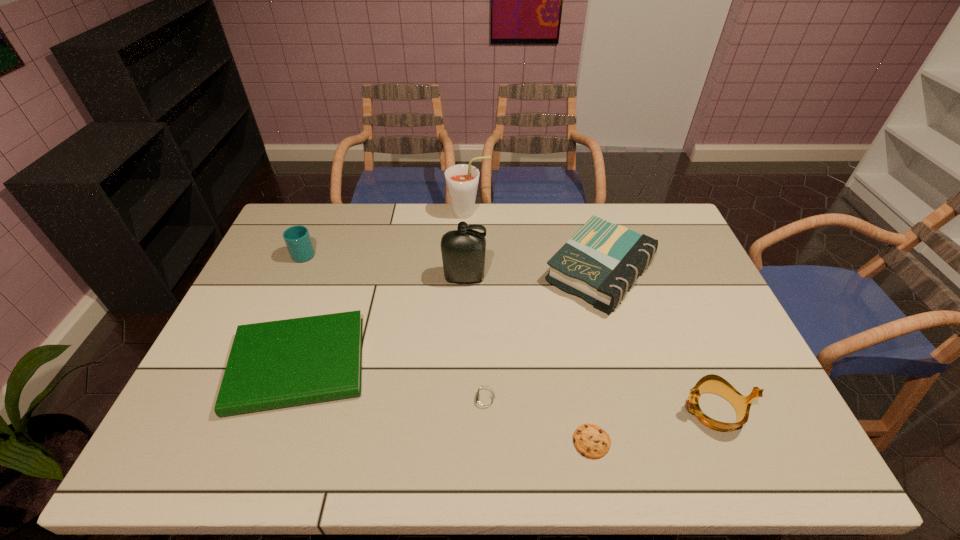
Identify the location of the farthest object. This screenshot has width=960, height=540. (462, 180).

You are a GUI agent. You are given a task and a screenshot of the screen. Output one action in this format:
    pyautogui.click(x=<x>, y=<y>)
    Task: Click on the bottle
    The image size is (960, 540).
    Given the screenshot: What is the action you would take?
    pyautogui.click(x=463, y=251)

This screenshot has width=960, height=540. I want to click on cup, so click(297, 238).

The height and width of the screenshot is (540, 960). Identify the location of the taller paperback book. (599, 263).

This screenshot has width=960, height=540. I want to click on the right paperback book, so click(599, 263).

Locate an element on the screen. The width and height of the screenshot is (960, 540). tiara is located at coordinates (711, 383).

The image size is (960, 540). In order to click on the third shortest object in this screenshot , I will do `click(285, 363)`.

Find the location of a particular element. The width and height of the screenshot is (960, 540). the shorter paperback book is located at coordinates (285, 363).

Locate an element on the screen. the second shortest object is located at coordinates (484, 400).

Where is `cookie`? This screenshot has width=960, height=540. cookie is located at coordinates (591, 441).